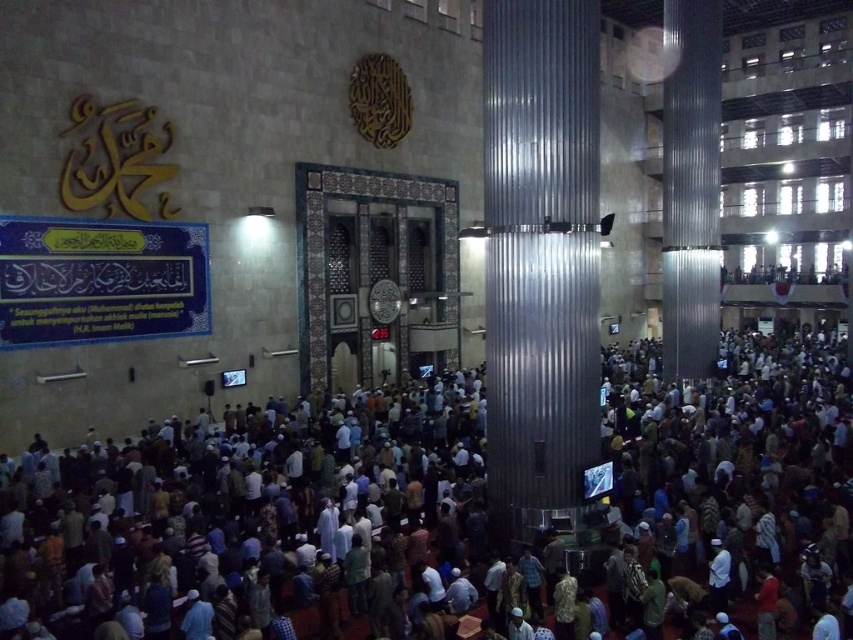
Question: Is dark brown fabric crowd at center positioned behind metallic corrugated pillar at center?

Choices:
 (A) yes
 (B) no

Answer: (B)

Question: Which point is farther to the camera?

Choices:
 (A) metallic corrugated pillar at center
 (B) dark brown fabric crowd at center

Answer: (A)

Question: Which point is closer to the camera?

Choices:
 (A) metallic corrugated pillar at center
 (B) dark brown fabric crowd at center

Answer: (B)

Question: Which point is farther to the camera?

Choices:
 (A) dark brown fabric crowd at center
 (B) metallic corrugated pillar at right
 (C) metallic corrugated pillar at center

Answer: (B)

Question: From the image, what is the correct spatial relationship of dark brown fabric crowd at center in relation to metallic corrugated pillar at center?

Choices:
 (A) below
 (B) above

Answer: (A)

Question: Is metallic corrugated pillar at center to the left of metallic corrugated pillar at right from the viewer's perspective?

Choices:
 (A) yes
 (B) no

Answer: (A)